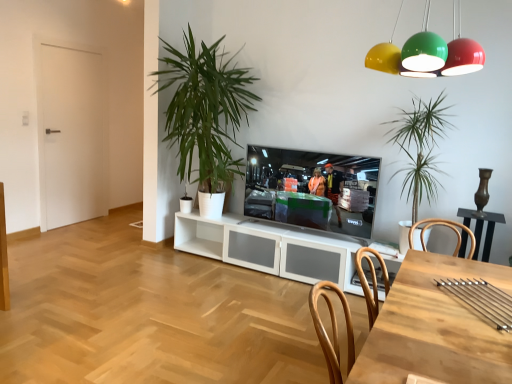
Question: Does green leafy plant at center, the first houseplant positioned from the left, have a greater width compared to wooden table at lower right?

Choices:
 (A) no
 (B) yes

Answer: (B)

Question: From a real-world perspective, is green leafy plant at center, the second houseplant when ordered from right to left, physically below wooden table at lower right?

Choices:
 (A) yes
 (B) no

Answer: (B)

Question: From the image's perspective, is green leafy plant at center, the first houseplant positioned from the left, beneath wooden table at lower right?

Choices:
 (A) no
 (B) yes

Answer: (A)

Question: Does green leafy plant at center, the second houseplant when ordered from right to left, touch wooden table at lower right?

Choices:
 (A) yes
 (B) no

Answer: (B)

Question: Is green leafy plant at center, the first houseplant positioned from the left, bigger than wooden table at lower right?

Choices:
 (A) no
 (B) yes

Answer: (B)

Question: Is point (403, 261) closer or farther from the camera than point (52, 82)?

Choices:
 (A) farther
 (B) closer

Answer: (B)

Question: Looking at the image, does wooden table at lower right seem bigger or smaller compared to white matte door at left?

Choices:
 (A) big
 (B) small

Answer: (A)

Question: Considering the positions of wooden table at lower right and white matte door at left in the image, is wooden table at lower right wider or thinner than white matte door at left?

Choices:
 (A) wide
 (B) thin

Answer: (A)

Question: Considering their positions, is wooden table at lower right located in front of or behind white matte door at left?

Choices:
 (A) front
 (B) behind

Answer: (A)

Question: From a real-world perspective, is white matte door at left above or below metallic dome lights at upper center?

Choices:
 (A) above
 (B) below

Answer: (B)

Question: Is point 66,61 positioned closer to the camera than point 381,56?

Choices:
 (A) farther
 (B) closer

Answer: (A)

Question: From the image's perspective, is white matte door at left located above or below metallic dome lights at upper center?

Choices:
 (A) below
 (B) above

Answer: (A)

Question: Relative to metallic dome lights at upper center, is white matte door at left in front or behind?

Choices:
 (A) front
 (B) behind

Answer: (B)

Question: Considering the relative positions of matte black television at center and white matte door at left in the image provided, is matte black television at center to the left or to the right of white matte door at left?

Choices:
 (A) right
 (B) left

Answer: (A)

Question: Does point (360, 200) appear closer or farther from the camera than point (56, 177)?

Choices:
 (A) closer
 (B) farther

Answer: (A)